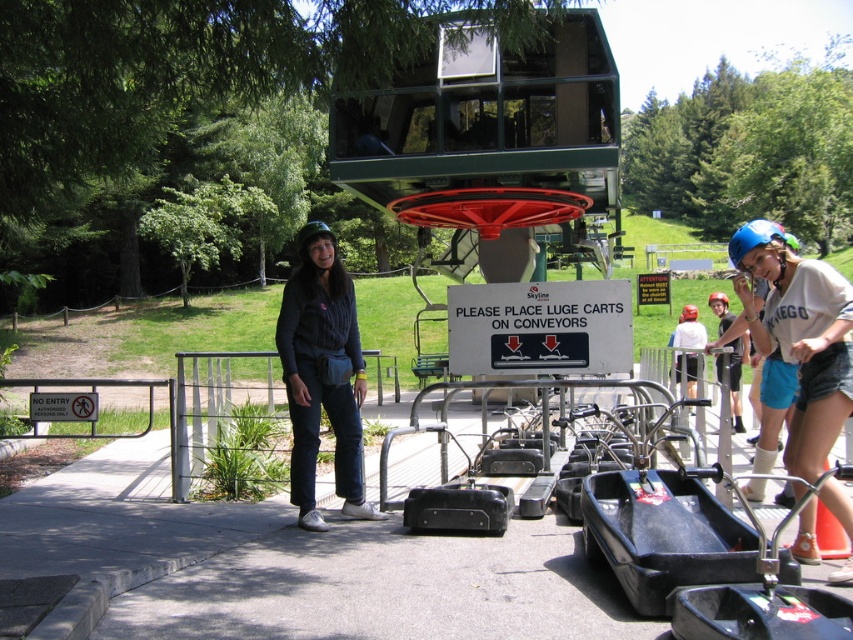
Who is more forward, (775, 241) or (335, 272)?

Point (775, 241) is more forward.

Is point (757, 227) positioned in front of point (312, 236)?

Yes, point (757, 227) is closer to viewer.

Between point (846, 579) and point (322, 368), which one is positioned behind?

The point (322, 368) is more distant.

Locate an element on the screen. The width and height of the screenshot is (853, 640). blue matte helmet at upper right is located at coordinates (799, 336).

Who is lower down, denim jeans at center or white plastic sign at center?

denim jeans at center

Is denim jeans at center wider than white plastic sign at center?

Incorrect, denim jeans at center's width does not surpass white plastic sign at center's.

Who is more distant from viewer, (357, 461) or (630, 326)?

Point (630, 326)

Image resolution: width=853 pixels, height=640 pixels. Identify the location of denim jeans at center. (322, 374).

Can you confirm if blue matte helmet at upper right is positioned below white plastic sign at center?

Yes.

Image resolution: width=853 pixels, height=640 pixels. Identify the location of blue matte helmet at upper right. (799, 336).